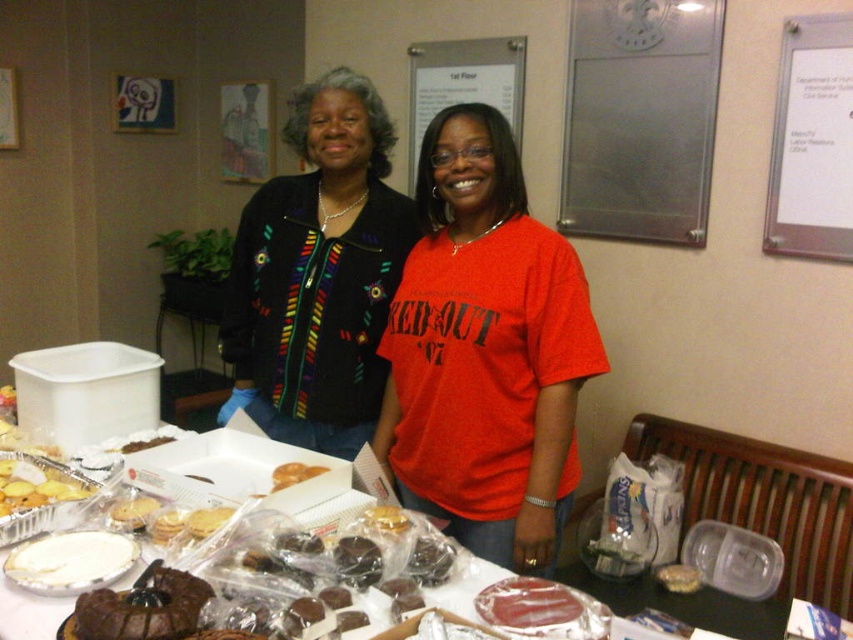
You are organizing a clothing display and need to arrange the matte black jacket at center and the multicolored embroidered sweater at center side by side on a shelf. Which item should you place on the left to ensure both fit without overlapping?

Place the matte black jacket at center on the left since it has a lesser width compared to the multicolored embroidered sweater at center, allowing both items to fit side by side without overlapping.

You are organizing a clothing donation drive and need to decide whether to place the multicolored embroidered sweater at center into a box that can only fit items narrower than the golden brown foil tray at lower left. Based on their sizes, should you place the sweater into the box?

The multicolored embroidered sweater at center is wider than the golden brown foil tray at lower left, so it cannot fit into the box designed for items narrower than the tray. Therefore, you should not place the sweater into the box.

You are organizing a photo shoot and need to place a 1.2 meter wide backdrop between the multicolored embroidered sweater at center and the golden brown foil tray at lower left. Will the backdrop fit between them?

The multicolored embroidered sweater at center is positioned on the right side of the golden brown foil tray at lower left. Since the distance between them isn t specified, we cannot determine if the 1.2 meter wide backdrop will fit. More information about their spacing is needed.